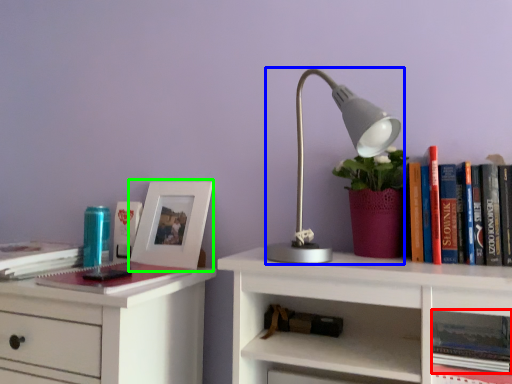
Question: Which object is positioned farthest from book (highlighted by a red box)? Select from lamp (highlighted by a blue box) and picture frame (highlighted by a green box).

Choices:
 (A) lamp
 (B) picture frame

Answer: (B)